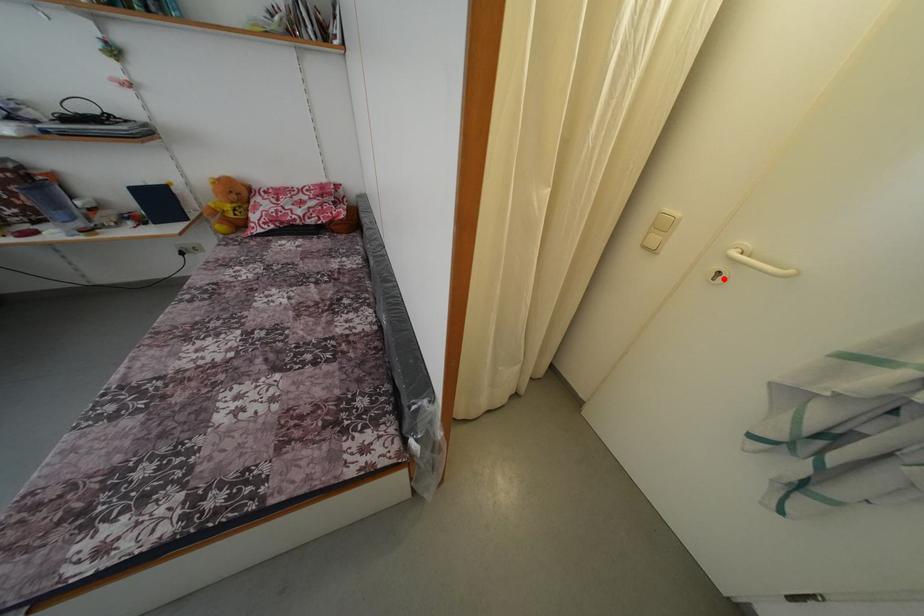
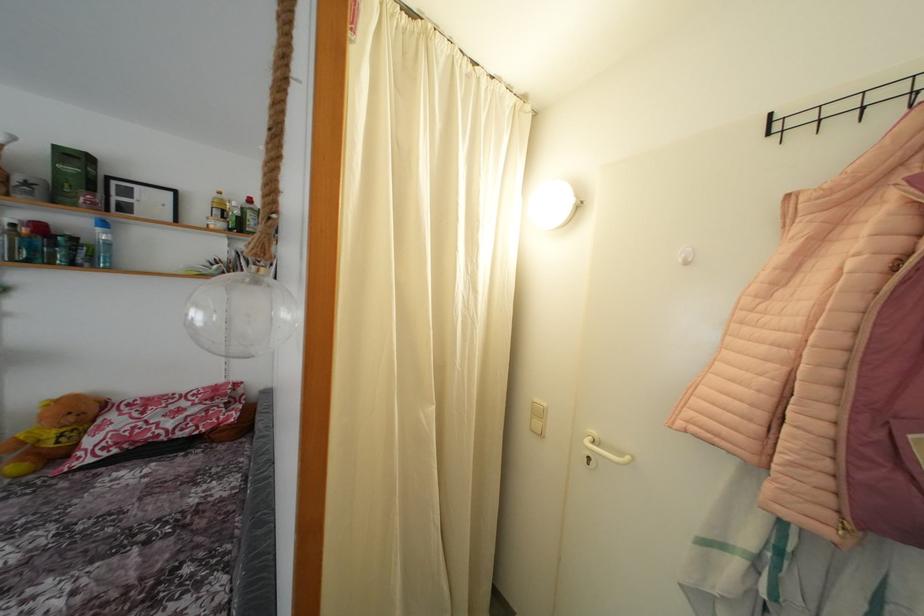
Question: I am providing you with two images of the same scene from different viewpoints. A red point is marked on the first image. Is the red point's position out of view in image 2?

Choices:
 (A) Yes
 (B) No

Answer: (B)